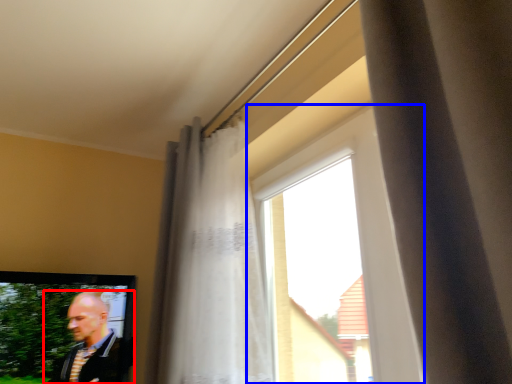
Question: Which object is further to the camera taking this photo, man (highlighted by a red box) or window (highlighted by a blue box)?

Choices:
 (A) man
 (B) window

Answer: (A)